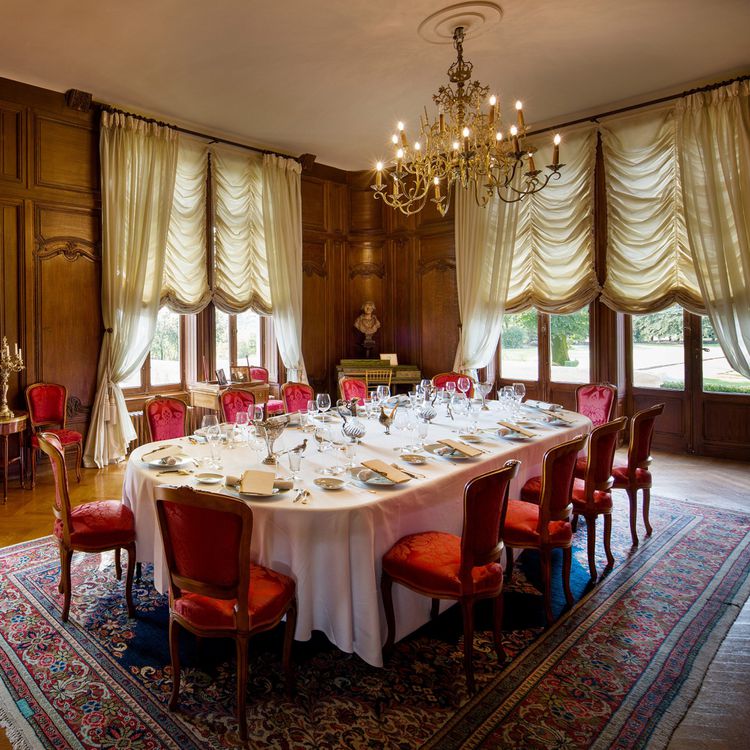
The image size is (750, 750). I want to click on carpet, so tap(668, 692).